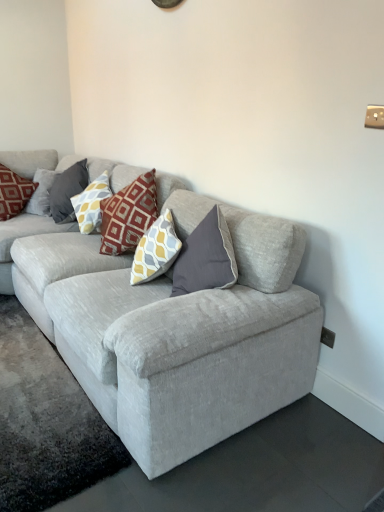
Identify the location of yellow and gray patterned pillow at upper left, the 2th pillow in the right-to-left sequence. This screenshot has width=384, height=512. click(67, 191).

Measure the distance between point (5, 207) and camera.

Point (5, 207) is 3.26 meters away from camera.

Describe the element at coordinates (91, 203) in the screenshot. The image size is (384, 512). I see `yellow and gray patterned pillow at center, the 3th pillow when ordered from left to right` at that location.

Locate an element on the screen. yellow and gray patterned pillow at upper left, the second pillow from the left is located at coordinates (67, 191).

Which is in front, point (35, 187) or point (52, 185)?

Point (52, 185)

Is matte red pillow at upper left, placed as the third pillow when sorted from right to left, located outside yellow and gray patterned pillow at upper left, the 2th pillow in the right-to-left sequence?

matte red pillow at upper left, placed as the third pillow when sorted from right to left, lies outside yellow and gray patterned pillow at upper left, the 2th pillow in the right-to-left sequence,'s area.

Which is more to the left, matte red pillow at upper left, which appears as the 1th pillow when viewed from the left, or yellow and gray patterned pillow at upper left, the 2th pillow in the right-to-left sequence?

matte red pillow at upper left, which appears as the 1th pillow when viewed from the left.

Which of these two, yellow and gray patterned pillow at center, the first pillow from the right, or matte red pillow at upper left, which appears as the 1th pillow when viewed from the left, is bigger?

matte red pillow at upper left, which appears as the 1th pillow when viewed from the left.

Between point (90, 195) and point (17, 186), which one is positioned behind?

The point (17, 186) is behind.

From a real-world perspective, does yellow and gray patterned pillow at center, the 3th pillow when ordered from left to right, stand above matte red pillow at upper left, which appears as the 1th pillow when viewed from the left?

Indeed, from a real-world perspective, yellow and gray patterned pillow at center, the 3th pillow when ordered from left to right, stands above matte red pillow at upper left, which appears as the 1th pillow when viewed from the left.

Visually, is yellow and gray patterned pillow at center, the first pillow from the right, positioned to the left or to the right of matte red pillow at upper left, placed as the third pillow when sorted from right to left?

Based on their positions, yellow and gray patterned pillow at center, the first pillow from the right, is located to the right of matte red pillow at upper left, placed as the third pillow when sorted from right to left.

Based on the photo, in terms of height, does yellow and gray patterned pillow at upper left, the 2th pillow in the right-to-left sequence, look taller or shorter compared to yellow and gray patterned pillow at center, the first pillow from the right?

yellow and gray patterned pillow at upper left, the 2th pillow in the right-to-left sequence, is taller than yellow and gray patterned pillow at center, the first pillow from the right.

Which is behind, yellow and gray patterned pillow at upper left, the 2th pillow in the right-to-left sequence, or yellow and gray patterned pillow at center, the 3th pillow when ordered from left to right?

yellow and gray patterned pillow at upper left, the 2th pillow in the right-to-left sequence, is further away from the camera.

Could you tell me if yellow and gray patterned pillow at upper left, the second pillow from the left, is turned towards yellow and gray patterned pillow at center, the 3th pillow when ordered from left to right?

No, yellow and gray patterned pillow at upper left, the second pillow from the left, does not turn towards yellow and gray patterned pillow at center, the 3th pillow when ordered from left to right.

You are a GUI agent. You are given a task and a screenshot of the screen. Output one action in this format:
    pyautogui.click(x=<x>, y=<y>)
    Task: Click on the studio couch in front of the yellow and gray patterned pillow at upper left, the second pillow from the left
    The image size is (384, 512).
    Given the screenshot: What is the action you would take?
    pyautogui.click(x=177, y=336)

Does point (53, 190) appear closer or farther from the camera than point (196, 351)?

Point (53, 190) is farther from the camera than point (196, 351).

Are yellow and gray patterned pillow at upper left, the second pillow from the left, and light gray fabric couch at center located far from each other?

yellow and gray patterned pillow at upper left, the second pillow from the left, is far away from light gray fabric couch at center.

Is light gray fabric couch at center surrounding matte red pillow at upper left, placed as the third pillow when sorted from right to left?

Yes.

From a real-world perspective, is light gray fabric couch at center physically above matte red pillow at upper left, which appears as the 1th pillow when viewed from the left?

No, from a real-world perspective, light gray fabric couch at center is not over matte red pillow at upper left, which appears as the 1th pillow when viewed from the left

Can you confirm if light gray fabric couch at center is bigger than matte red pillow at upper left, placed as the third pillow when sorted from right to left?

Indeed, light gray fabric couch at center has a larger size compared to matte red pillow at upper left, placed as the third pillow when sorted from right to left.

Image resolution: width=384 pixels, height=512 pixels. I want to click on studio couch that is under the matte red pillow at upper left, placed as the third pillow when sorted from right to left (from a real-world perspective), so click(x=177, y=336).

Considering the positions of objects matte red pillow at upper left, placed as the third pillow when sorted from right to left, and yellow and gray patterned pillow at center, the 3th pillow when ordered from left to right, in the image provided, who is more to the right, matte red pillow at upper left, placed as the third pillow when sorted from right to left, or yellow and gray patterned pillow at center, the 3th pillow when ordered from left to right,?

From the viewer's perspective, yellow and gray patterned pillow at center, the 3th pillow when ordered from left to right, appears more on the right side.

Is matte red pillow at upper left, placed as the third pillow when sorted from right to left, positioned beyond the bounds of yellow and gray patterned pillow at center, the 3th pillow when ordered from left to right?

Yes.

Is point (15, 182) positioned behind point (86, 220)?

Yes.

Considering the relative sizes of yellow and gray patterned pillow at center, the 3th pillow when ordered from left to right, and yellow and gray patterned pillow at upper left, the second pillow from the left, in the image provided, is yellow and gray patterned pillow at center, the 3th pillow when ordered from left to right, smaller than yellow and gray patterned pillow at upper left, the second pillow from the left,?

Yes.

From a real-world perspective, which is physically above, yellow and gray patterned pillow at center, the 3th pillow when ordered from left to right, or yellow and gray patterned pillow at upper left, the second pillow from the left?

yellow and gray patterned pillow at center, the 3th pillow when ordered from left to right, is physically above.

Is yellow and gray patterned pillow at center, the 3th pillow when ordered from left to right, situated inside yellow and gray patterned pillow at upper left, the second pillow from the left, or outside?

yellow and gray patterned pillow at center, the 3th pillow when ordered from left to right, is outside yellow and gray patterned pillow at upper left, the second pillow from the left.

Where is `pillow that is the 1st one when counting downward from the matte red pillow at upper left, placed as the third pillow when sorted from right to left (from the image's perspective)`? pillow that is the 1st one when counting downward from the matte red pillow at upper left, placed as the third pillow when sorted from right to left (from the image's perspective) is located at coordinates (67, 191).

At what (x,y) coordinates should I click in order to perform the action: click on the 2nd pillow to the left of the yellow and gray patterned pillow at center, the 3th pillow when ordered from left to right, counting from the anchor's position. Please return your answer as a coordinate pair (x, y). The width and height of the screenshot is (384, 512). Looking at the image, I should click on click(13, 192).

From the image, which object appears to be farther from yellow and gray patterned pillow at upper left, the second pillow from the left, light gray fabric couch at center or yellow and gray patterned pillow at center, the first pillow from the right?

light gray fabric couch at center is further to yellow and gray patterned pillow at upper left, the second pillow from the left.

From the image, which object appears to be farther from light gray fabric couch at center, yellow and gray patterned pillow at upper left, the 2th pillow in the right-to-left sequence, or yellow and gray patterned pillow at center, the first pillow from the right?

Among the two, yellow and gray patterned pillow at upper left, the 2th pillow in the right-to-left sequence, is located further to light gray fabric couch at center.

Based on the photo, based on their spatial positions, is yellow and gray patterned pillow at upper left, the second pillow from the left, or matte red pillow at upper left, placed as the third pillow when sorted from right to left, further from yellow and gray patterned pillow at center, the first pillow from the right?

Among the two, matte red pillow at upper left, placed as the third pillow when sorted from right to left, is located further to yellow and gray patterned pillow at center, the first pillow from the right.

Based on their spatial positions, is yellow and gray patterned pillow at center, the 3th pillow when ordered from left to right, or light gray fabric couch at center further from matte red pillow at upper left, placed as the third pillow when sorted from right to left?

light gray fabric couch at center lies further to matte red pillow at upper left, placed as the third pillow when sorted from right to left, than the other object.

Estimate the real-world distances between objects in this image. Which object is further from yellow and gray patterned pillow at upper left, the second pillow from the left, light gray fabric couch at center or matte red pillow at upper left, which appears as the 1th pillow when viewed from the left?

Based on the image, light gray fabric couch at center appears to be further to yellow and gray patterned pillow at upper left, the second pillow from the left.

When comparing their distances from yellow and gray patterned pillow at center, the first pillow from the right, does light gray fabric couch at center or yellow and gray patterned pillow at upper left, the second pillow from the left, seem further?

light gray fabric couch at center lies further to yellow and gray patterned pillow at center, the first pillow from the right, than the other object.

Estimate the real-world distances between objects in this image. Which object is closer to yellow and gray patterned pillow at upper left, the second pillow from the left, yellow and gray patterned pillow at center, the 3th pillow when ordered from left to right, or light gray fabric couch at center?

yellow and gray patterned pillow at center, the 3th pillow when ordered from left to right, is closer to yellow and gray patterned pillow at upper left, the second pillow from the left.

Based on their spatial positions, is matte red pillow at upper left, which appears as the 1th pillow when viewed from the left, or light gray fabric couch at center closer to yellow and gray patterned pillow at upper left, the 2th pillow in the right-to-left sequence?

matte red pillow at upper left, which appears as the 1th pillow when viewed from the left, lies closer to yellow and gray patterned pillow at upper left, the 2th pillow in the right-to-left sequence, than the other object.

I want to click on pillow between light gray fabric couch at center and yellow and gray patterned pillow at upper left, the 2th pillow in the right-to-left sequence, in the front-back direction, so click(x=91, y=203).

Where is `pillow between matte red pillow at upper left, which appears as the 1th pillow when viewed from the left, and yellow and gray patterned pillow at center, the 3th pillow when ordered from left to right, from left to right`? This screenshot has height=512, width=384. pillow between matte red pillow at upper left, which appears as the 1th pillow when viewed from the left, and yellow and gray patterned pillow at center, the 3th pillow when ordered from left to right, from left to right is located at coordinates (67, 191).